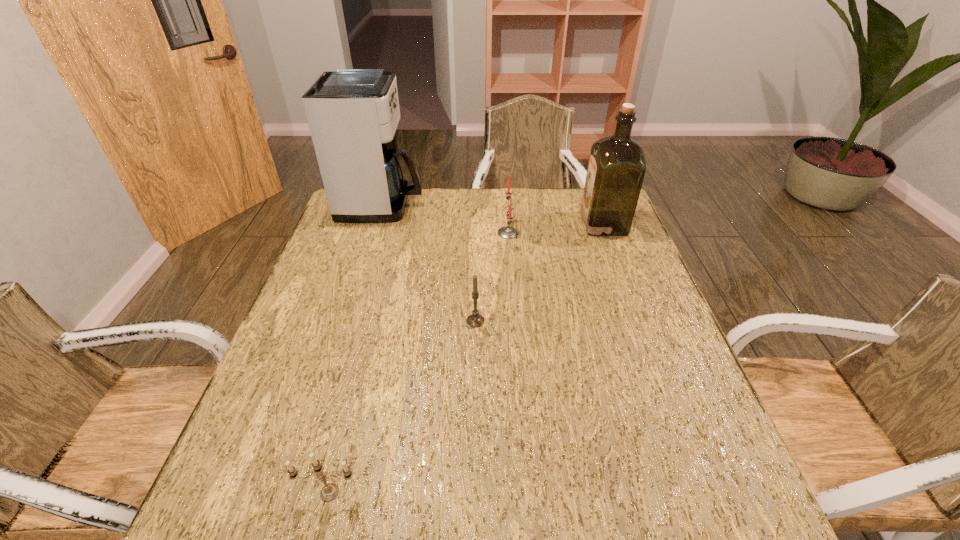
Image resolution: width=960 pixels, height=540 pixels. Identify the location of free location that satisfies the following two spatial constraints: 1. on the front panel of the coffee maker; 2. on the back side of the nearest object. (292, 492).